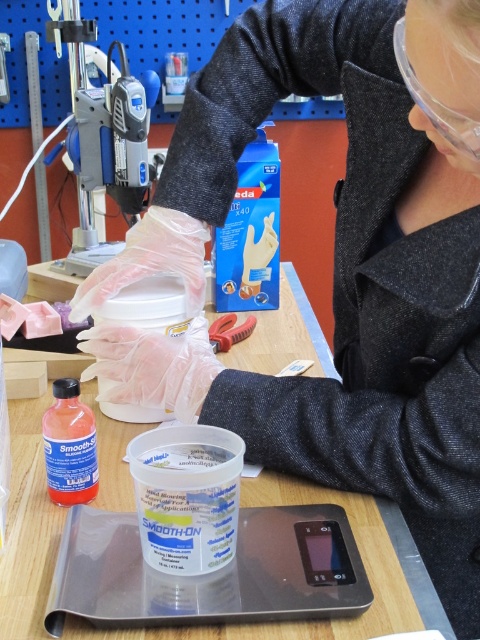
Question: Which point is closer to the camera taking this photo?

Choices:
 (A) [x=73, y=500]
 (B) [x=235, y=326]

Answer: (A)

Question: Does translucent orange liquid at center have a larger size compared to rubberized plastic pliers at center?

Choices:
 (A) no
 (B) yes

Answer: (A)

Question: Is clear plastic goggles at upper right thinner than rubberized plastic pliers at center?

Choices:
 (A) yes
 (B) no

Answer: (A)

Question: Where is clear plastic goggles at upper right located in relation to rubberized plastic pliers at center in the image?

Choices:
 (A) below
 (B) above

Answer: (B)

Question: Estimate the real-world distances between objects in this image. Which object is closer to the translucent orange liquid at center?

Choices:
 (A) rubberized plastic pliers at center
 (B) clear plastic goggles at upper right

Answer: (A)

Question: Which point is farther to the camera?

Choices:
 (A) (434, 99)
 (B) (216, 340)

Answer: (B)